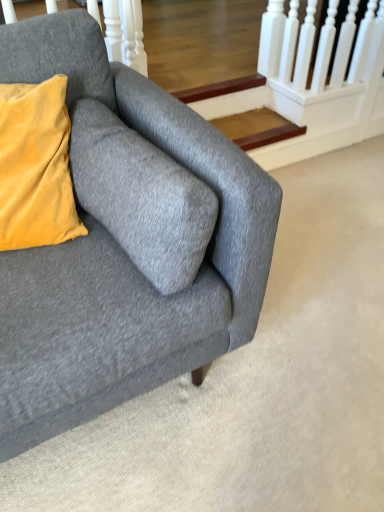
Question: Does gray fabric couch at lower left have a greater width compared to velvet yellow pillow at upper left?

Choices:
 (A) yes
 (B) no

Answer: (A)

Question: Can you confirm if gray fabric couch at lower left is smaller than velvet yellow pillow at upper left?

Choices:
 (A) yes
 (B) no

Answer: (B)

Question: Are gray fabric couch at lower left and velvet yellow pillow at upper left located far from each other?

Choices:
 (A) yes
 (B) no

Answer: (B)

Question: Is gray fabric couch at lower left aimed at velvet yellow pillow at upper left?

Choices:
 (A) yes
 (B) no

Answer: (A)

Question: Considering the relative positions of gray fabric couch at lower left and velvet yellow pillow at upper left in the image provided, is gray fabric couch at lower left to the left of velvet yellow pillow at upper left from the viewer's perspective?

Choices:
 (A) no
 (B) yes

Answer: (A)

Question: Is gray fabric couch at lower left behind velvet yellow pillow at upper left?

Choices:
 (A) no
 (B) yes

Answer: (A)

Question: From a real-world perspective, is velvet yellow pillow at upper left physically above gray fabric couch at lower left?

Choices:
 (A) yes
 (B) no

Answer: (A)

Question: Is velvet yellow pillow at upper left positioned before gray fabric couch at lower left?

Choices:
 (A) no
 (B) yes

Answer: (A)

Question: Can gray fabric couch at lower left be found inside velvet yellow pillow at upper left?

Choices:
 (A) no
 (B) yes

Answer: (A)

Question: Is velvet yellow pillow at upper left outside gray fabric couch at lower left?

Choices:
 (A) yes
 (B) no

Answer: (B)

Question: Considering the relative sizes of velvet yellow pillow at upper left and gray fabric couch at lower left in the image provided, is velvet yellow pillow at upper left shorter than gray fabric couch at lower left?

Choices:
 (A) no
 (B) yes

Answer: (B)

Question: Could you tell me if velvet yellow pillow at upper left is facing gray fabric couch at lower left?

Choices:
 (A) no
 (B) yes

Answer: (B)

Question: Is velvet yellow pillow at upper left in front of or behind gray fabric couch at lower left in the image?

Choices:
 (A) behind
 (B) front

Answer: (A)